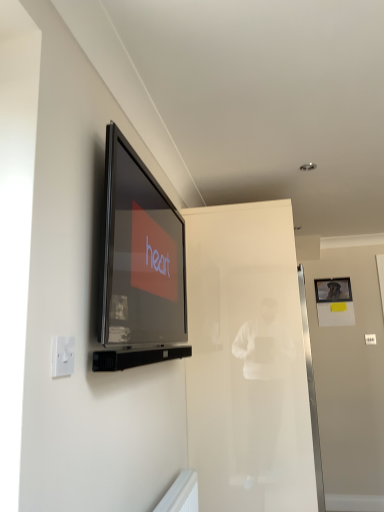
Where is `white plastic electric outlet at lower left`? white plastic electric outlet at lower left is located at coordinates (62, 356).

Find the location of `white plastic light switch at upper left`. white plastic light switch at upper left is located at coordinates (370, 339).

You are a GUI agent. You are given a task and a screenshot of the screen. Output one action in this format:
    pyautogui.click(x=<x>, y=<y>)
    Task: Click on the transparent glass door at center
    Image resolution: width=384 pixels, height=512 pixels.
    Given the screenshot: What is the action you would take?
    pyautogui.click(x=248, y=361)

This screenshot has height=512, width=384. Describe the element at coordinates (140, 254) in the screenshot. I see `matte black television at upper left` at that location.

I want to click on white plastic electric outlet at lower left, so click(x=62, y=356).

Which is less distant, (329, 295) or (218, 332)?

Point (218, 332)

Between metallic silver picture frame at upper right and transparent glass door at center, which one has more height?

transparent glass door at center.

Considering the sizes of objects metallic silver picture frame at upper right and transparent glass door at center in the image provided, who is smaller, metallic silver picture frame at upper right or transparent glass door at center?

Smaller between the two is metallic silver picture frame at upper right.

Is metallic silver picture frame at upper right turned away from transparent glass door at center?

No, metallic silver picture frame at upper right is not facing away from transparent glass door at center.

Can we say white plastic light switch at upper left lies outside transparent glass door at center?

white plastic light switch at upper left is positioned outside transparent glass door at center.

From the image's perspective, which object appears higher, white plastic light switch at upper left or transparent glass door at center?

white plastic light switch at upper left is shown above in the image.

Between white plastic light switch at upper left and transparent glass door at center, which one has smaller size?

With smaller size is white plastic light switch at upper left.

Is matte black television at upper left placed right next to transparent glass door at center?

matte black television at upper left is not next to transparent glass door at center, and they're not touching.

Is matte black television at upper left looking in the opposite direction of transparent glass door at center?

matte black television at upper left does not have its back to transparent glass door at center.

In terms of height, does matte black television at upper left look taller or shorter compared to transparent glass door at center?

In the image, matte black television at upper left appears to be shorter than transparent glass door at center.

Is matte black television at upper left at the right side of transparent glass door at center?

No, matte black television at upper left is not to the right of transparent glass door at center.

Is transparent glass door at center situated inside white plastic electric outlet at lower left or outside?

transparent glass door at center is spatially situated outside white plastic electric outlet at lower left.

Is transparent glass door at center bigger than white plastic electric outlet at lower left?

Yes, transparent glass door at center is bigger than white plastic electric outlet at lower left.

Is transparent glass door at center positioned far away from white plastic electric outlet at lower left?

That's right, there is a large distance between transparent glass door at center and white plastic electric outlet at lower left.

Is transparent glass door at center wider than white plastic electric outlet at lower left?

Indeed, transparent glass door at center has a greater width compared to white plastic electric outlet at lower left.

From a real-world perspective, is white plastic electric outlet at lower left physically above matte black television at upper left?

No.

Is white plastic electric outlet at lower left inside or outside of matte black television at upper left?

white plastic electric outlet at lower left is spatially situated outside matte black television at upper left.

The height and width of the screenshot is (512, 384). In order to click on television that appears behind the white plastic electric outlet at lower left in this screenshot , I will do `click(140, 254)`.

Between white plastic electric outlet at lower left and matte black television at upper left, which one appears on the left side from the viewer's perspective?

white plastic electric outlet at lower left is more to the left.

Consider the image. How different are the orientations of metallic silver picture frame at upper right and matte black television at upper left in degrees?

90.6 degrees.

The width and height of the screenshot is (384, 512). What are the coordinates of `television above the metallic silver picture frame at upper right (from the image's perspective)` in the screenshot? It's located at coord(140,254).

From a real-world perspective, does metallic silver picture frame at upper right stand above matte black television at upper left?

Indeed, from a real-world perspective, metallic silver picture frame at upper right stands above matte black television at upper left.

Is metallic silver picture frame at upper right outside of matte black television at upper left?

Absolutely, metallic silver picture frame at upper right is external to matte black television at upper left.

Which of these two, white plastic light switch at upper left or white plastic electric outlet at lower left, stands shorter?

Standing shorter between the two is white plastic electric outlet at lower left.

How many degrees apart are the facing directions of white plastic light switch at upper left and white plastic electric outlet at lower left?

92.7 degrees.

Does point (367, 336) come farther from viewer compared to point (65, 354)?

Yes, point (367, 336) is farther from viewer.

This screenshot has height=512, width=384. I want to click on picture frame behind the transparent glass door at center, so click(333, 290).

Identify the location of light switch on the right of transparent glass door at center. Image resolution: width=384 pixels, height=512 pixels. (370, 339).

Looking at the image, which one is located closer to white plastic light switch at upper left, white plastic electric outlet at lower left or matte black television at upper left?

matte black television at upper left lies closer to white plastic light switch at upper left than the other object.

From the image, which object appears to be nearer to white plastic light switch at upper left, transparent glass door at center or matte black television at upper left?

transparent glass door at center.

In the scene shown: Based on their spatial positions, is matte black television at upper left or metallic silver picture frame at upper right closer to white plastic light switch at upper left?

metallic silver picture frame at upper right is closer to white plastic light switch at upper left.

Considering their positions, is transparent glass door at center positioned further to metallic silver picture frame at upper right than white plastic electric outlet at lower left?

Among the two, white plastic electric outlet at lower left is located further to metallic silver picture frame at upper right.

From the image, which object appears to be farther from matte black television at upper left, metallic silver picture frame at upper right or transparent glass door at center?

metallic silver picture frame at upper right lies further to matte black television at upper left than the other object.

From the image, which object appears to be nearer to metallic silver picture frame at upper right, white plastic electric outlet at lower left or transparent glass door at center?

Among the two, transparent glass door at center is located nearer to metallic silver picture frame at upper right.

Considering their positions, is metallic silver picture frame at upper right positioned further to white plastic electric outlet at lower left than matte black television at upper left?

metallic silver picture frame at upper right is further to white plastic electric outlet at lower left.

Based on their spatial positions, is transparent glass door at center or matte black television at upper left closer to metallic silver picture frame at upper right?

transparent glass door at center lies closer to metallic silver picture frame at upper right than the other object.

The image size is (384, 512). What are the coordinates of `light switch between white plastic electric outlet at lower left and metallic silver picture frame at upper right from front to back` in the screenshot? It's located at (370, 339).

Where is `glass door positioned between matte black television at upper left and white plastic light switch at upper left from near to far`? This screenshot has height=512, width=384. glass door positioned between matte black television at upper left and white plastic light switch at upper left from near to far is located at coordinates (248, 361).

Where is `light switch positioned between transparent glass door at center and metallic silver picture frame at upper right from near to far`? This screenshot has width=384, height=512. light switch positioned between transparent glass door at center and metallic silver picture frame at upper right from near to far is located at coordinates (370, 339).

At what (x,y) coordinates should I click in order to perform the action: click on light switch between matte black television at upper left and metallic silver picture frame at upper right along the z-axis. Please return your answer as a coordinate pair (x, y). This screenshot has width=384, height=512. Looking at the image, I should click on (370, 339).